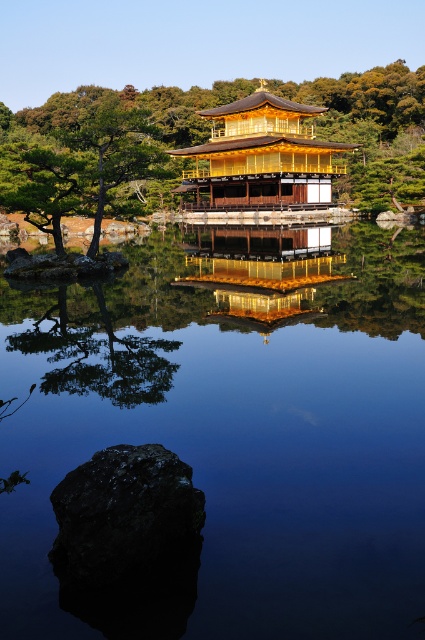
Question: Is green leafy tree at center in front of golden polished wood temple at center?

Choices:
 (A) no
 (B) yes

Answer: (B)

Question: Does transparent glass lake at center appear under golden polished wood temple at center?

Choices:
 (A) yes
 (B) no

Answer: (A)

Question: Does green leafy tree at center have a larger size compared to golden polished wood temple at center?

Choices:
 (A) yes
 (B) no

Answer: (A)

Question: Which object appears farthest from the camera in this image?

Choices:
 (A) golden polished wood temple at center
 (B) transparent glass lake at center
 (C) smooth brown tree trunk at upper center
 (D) green leafy tree at center

Answer: (A)

Question: Which point is farther to the camera?

Choices:
 (A) green leafy tree at center
 (B) transparent glass lake at center
 (C) smooth brown tree trunk at upper center
 (D) golden polished wood temple at center

Answer: (D)

Question: Based on their relative distances, which object is farther from the green leafy tree at center?

Choices:
 (A) smooth brown tree trunk at upper center
 (B) golden polished wood temple at center

Answer: (A)